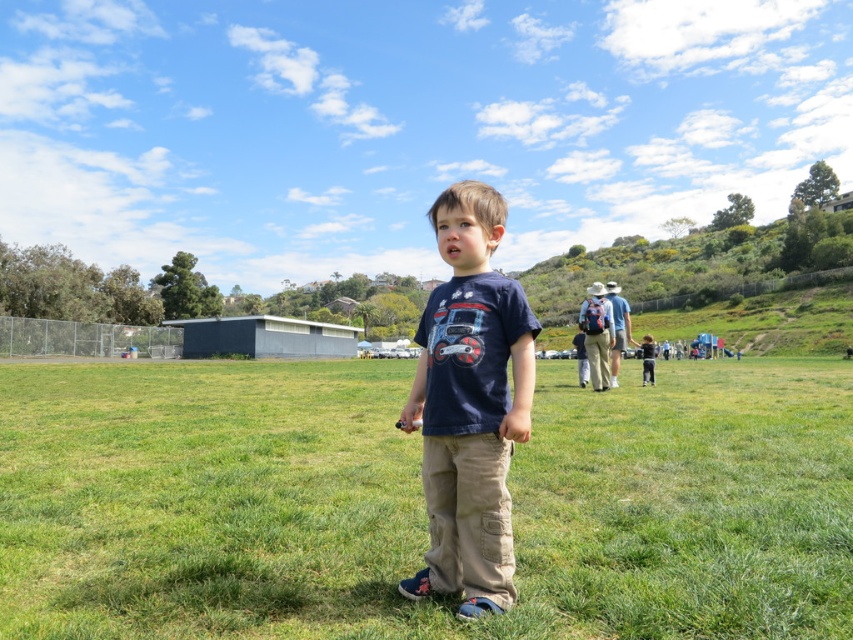
You are standing at the point with coordinates point [650,340] and want to walk to the point with coordinates point [485,408]. Which direction should you move relative to the other point?

You should move forward towards point [485,408] because it is in front of point [650,340].